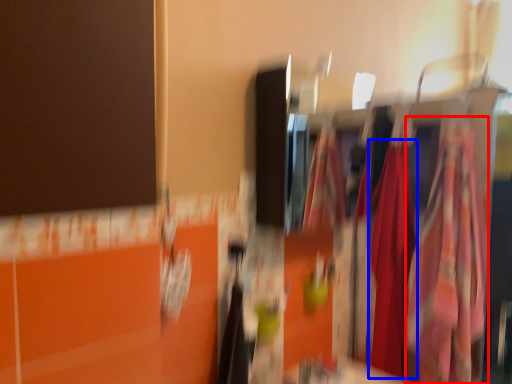
Question: Which of the following is the farthest to the observer, clothing (highlighted by a red box) or clothing (highlighted by a blue box)?

Choices:
 (A) clothing
 (B) clothing

Answer: (B)